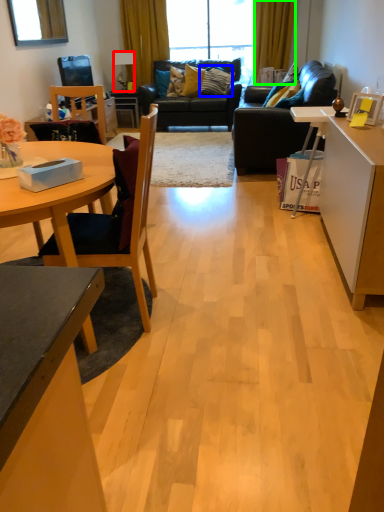
Question: Which object is the farthest from lamp (highlighted by a red box)? Choose among these: pillow (highlighted by a blue box) or curtain (highlighted by a green box).

Choices:
 (A) pillow
 (B) curtain

Answer: (B)